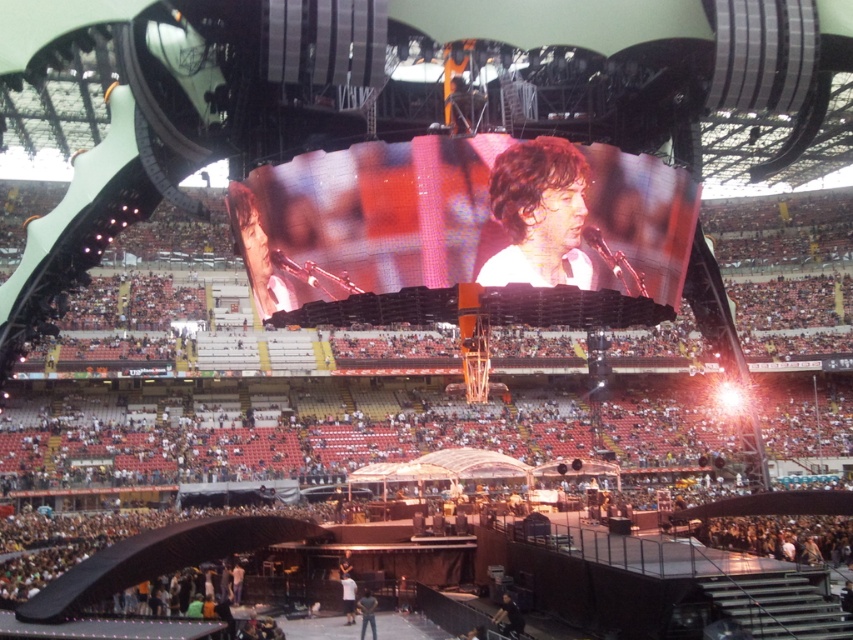
Can you confirm if dark brown leather jacket at lower center is wider than white cotton shirt at center?

Incorrect, dark brown leather jacket at lower center's width does not surpass white cotton shirt at center's.

Locate an element on the screen. This screenshot has height=640, width=853. dark brown leather jacket at lower center is located at coordinates (508, 618).

Is shiny black hair at center taller than white cotton shirt at center?

Correct, shiny black hair at center is much taller as white cotton shirt at center.

Where is `shiny black hair at center`? The height and width of the screenshot is (640, 853). shiny black hair at center is located at coordinates (538, 214).

Where is `shiny black hair at center`? This screenshot has width=853, height=640. shiny black hair at center is located at coordinates (538, 214).

Is shiny black hair at center to the left of dark brown leather jacket at lower center from the viewer's perspective?

In fact, shiny black hair at center is to the right of dark brown leather jacket at lower center.

Which is in front, point (579, 196) or point (514, 627)?

Point (579, 196)

Which is in front, point (500, 168) or point (519, 611)?

Point (500, 168) is in front.

At what (x,y) coordinates should I click in order to perform the action: click on shiny black hair at center. Please return your answer as a coordinate pair (x, y). The height and width of the screenshot is (640, 853). Looking at the image, I should click on (538, 214).